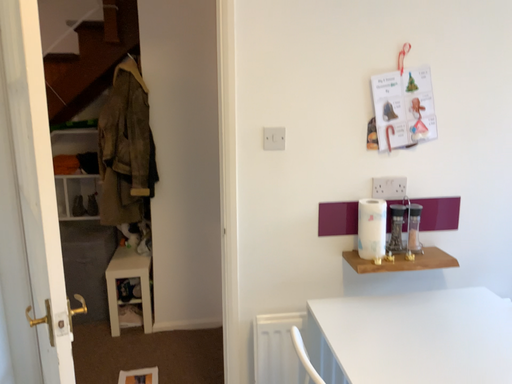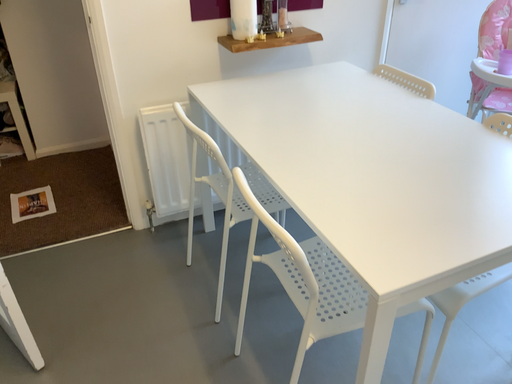
Question: Which way did the camera rotate in the video?

Choices:
 (A) rotated upward
 (B) rotated downward

Answer: (B)